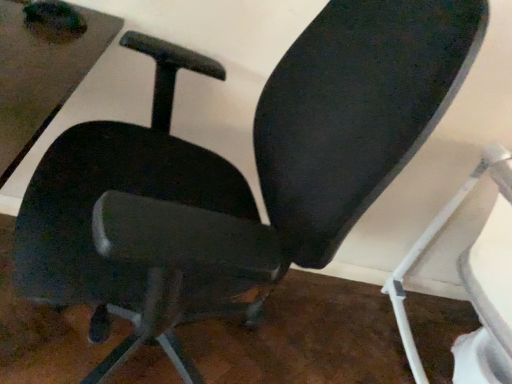
The width and height of the screenshot is (512, 384). Describe the element at coordinates (431, 240) in the screenshot. I see `matte black chair at center` at that location.

Measure the distance between matte black chair at center and camera.

The depth of matte black chair at center is 1.22 meters.

Where is `matte black chair at center`? matte black chair at center is located at coordinates (431, 240).

Where is `matte black chair at center`? matte black chair at center is located at coordinates (431, 240).